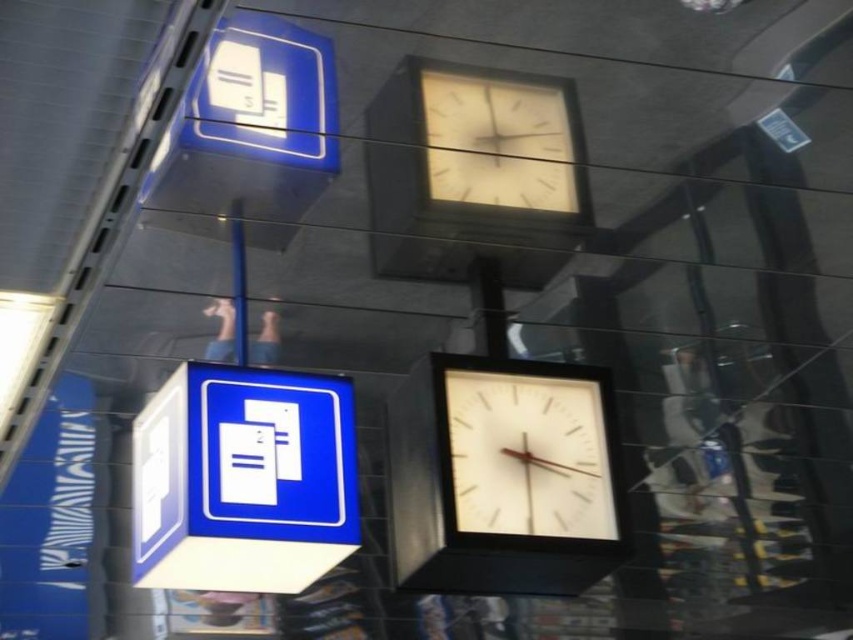
Question: Among these points, which one is farthest from the camera?

Choices:
 (A) (241, 328)
 (B) (584, 531)
 (C) (158, 451)
 (D) (427, 72)

Answer: (A)

Question: Can you confirm if white glossy clock at center is wider than white matte clock at upper center?

Choices:
 (A) yes
 (B) no

Answer: (A)

Question: Estimate the real-world distances between objects in this image. Which object is closer to the white glossy clock at center?

Choices:
 (A) white matte clock at upper center
 (B) blue glossy sign at upper left
 (C) metallic pole at center

Answer: (B)

Question: Among these objects, which one is nearest to the camera?

Choices:
 (A) blue glossy sign at upper left
 (B) metallic pole at center

Answer: (A)

Question: Is white glossy clock at center to the right of white matte clock at upper center from the viewer's perspective?

Choices:
 (A) yes
 (B) no

Answer: (A)

Question: Does white matte clock at upper center appear over metallic pole at center?

Choices:
 (A) no
 (B) yes

Answer: (B)